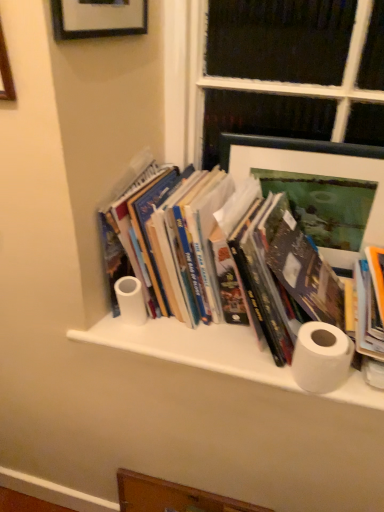
Locate an element on the screen. The width and height of the screenshot is (384, 512). free location above white matte cabinet at center (from a real-world perspective) is located at coordinates 201,336.